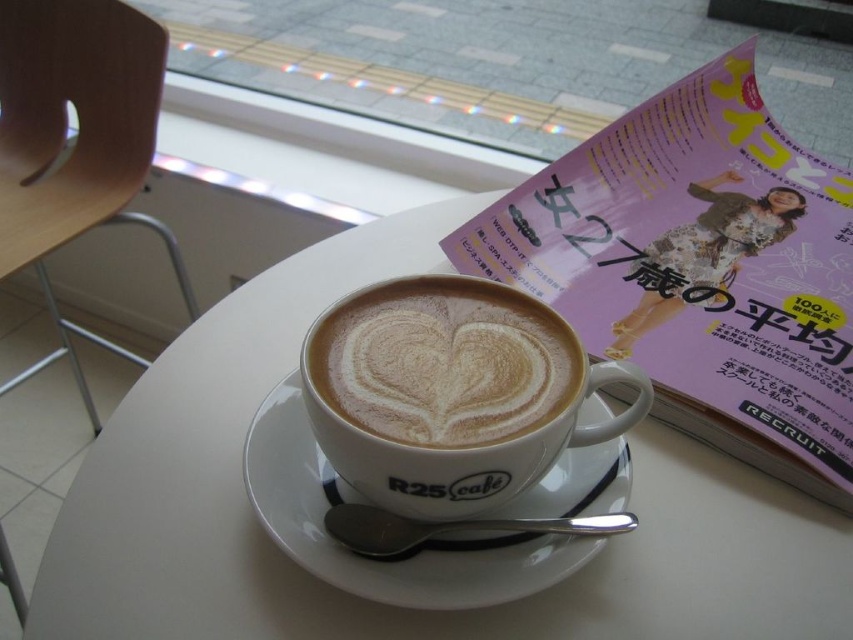
Question: Does cappuccino foam art at center have a smaller size compared to white ceramic saucer at center?

Choices:
 (A) no
 (B) yes

Answer: (B)

Question: Which object is closer to the camera taking this photo?

Choices:
 (A) matte paper magazine at upper right
 (B) white ceramic saucer at center
 (C) white ceramic table at center
 (D) cappuccino foam art at center

Answer: (D)

Question: Based on their relative distances, which object is nearer to the cappuccino foam art at center?

Choices:
 (A) white ceramic table at center
 (B) matte paper magazine at upper right

Answer: (A)

Question: Considering the relative positions of white ceramic table at center and white ceramic saucer at center in the image provided, where is white ceramic table at center located with respect to white ceramic saucer at center?

Choices:
 (A) above
 (B) below

Answer: (A)

Question: Estimate the real-world distances between objects in this image. Which object is farther from the cappuccino foam art at center?

Choices:
 (A) matte paper magazine at upper right
 (B) white ceramic saucer at center
 (C) white ceramic table at center

Answer: (A)

Question: Does matte paper magazine at upper right have a larger size compared to white ceramic saucer at center?

Choices:
 (A) yes
 (B) no

Answer: (A)